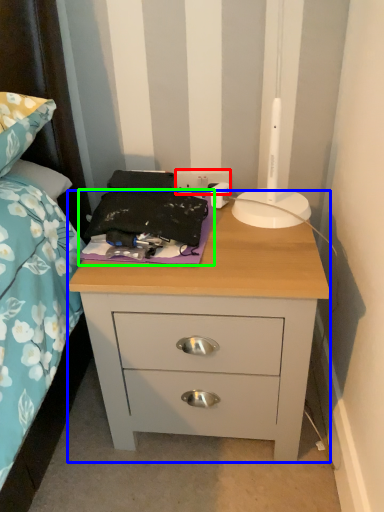
Question: Considering the real-world distances, which object is farthest from electric outlet (highlighted by a red box)? nightstand (highlighted by a blue box) or sheet (highlighted by a green box)?

Choices:
 (A) nightstand
 (B) sheet

Answer: (A)